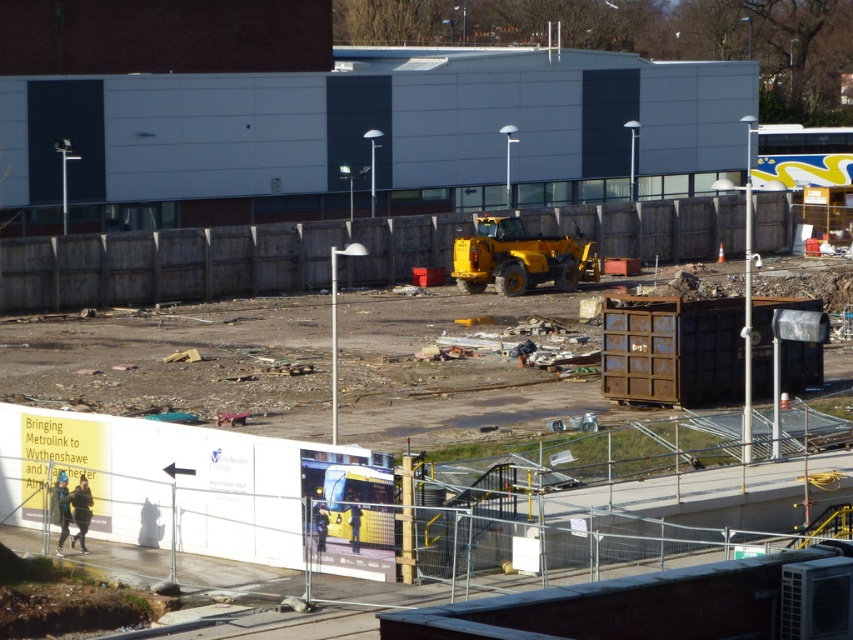
Between yellow rubber tire at center and yellow rubber tractor at center, which one appears on the right side from the viewer's perspective?

yellow rubber tire at center

Who is more forward, [613,531] or [512,216]?

Positioned in front is point [613,531].

At what (x,y) coordinates should I click in order to perform the action: click on yellow rubber tire at center. Please return your answer as a coordinate pair (x, y). This screenshot has height=640, width=853. Looking at the image, I should click on (154, 483).